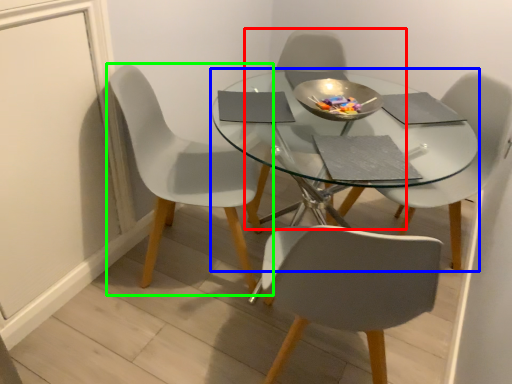
Question: Which object is positioned farthest from chair (highlighted by a red box)? Select from round table (highlighted by a blue box) and chair (highlighted by a green box).

Choices:
 (A) round table
 (B) chair

Answer: (B)